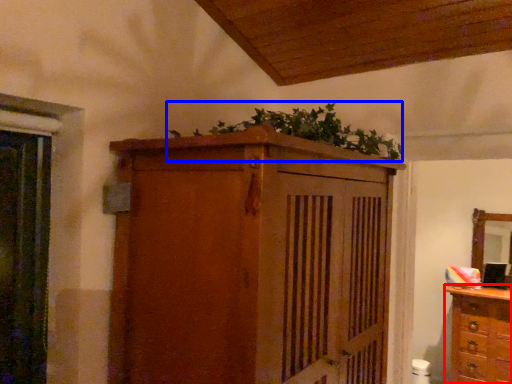
Question: Which of the following is the farthest to the observer, chest of drawers (highlighted by a red box) or plant (highlighted by a blue box)?

Choices:
 (A) chest of drawers
 (B) plant

Answer: (A)